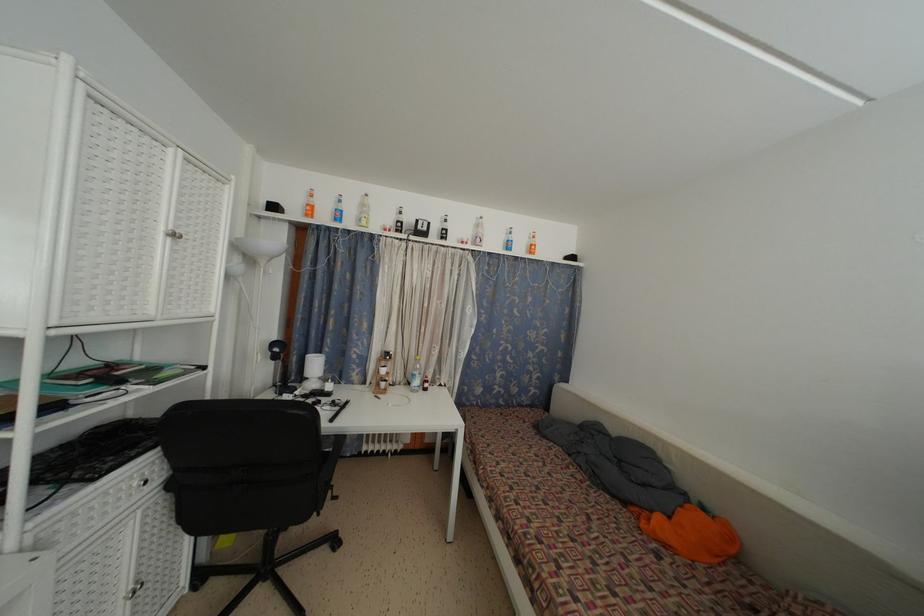
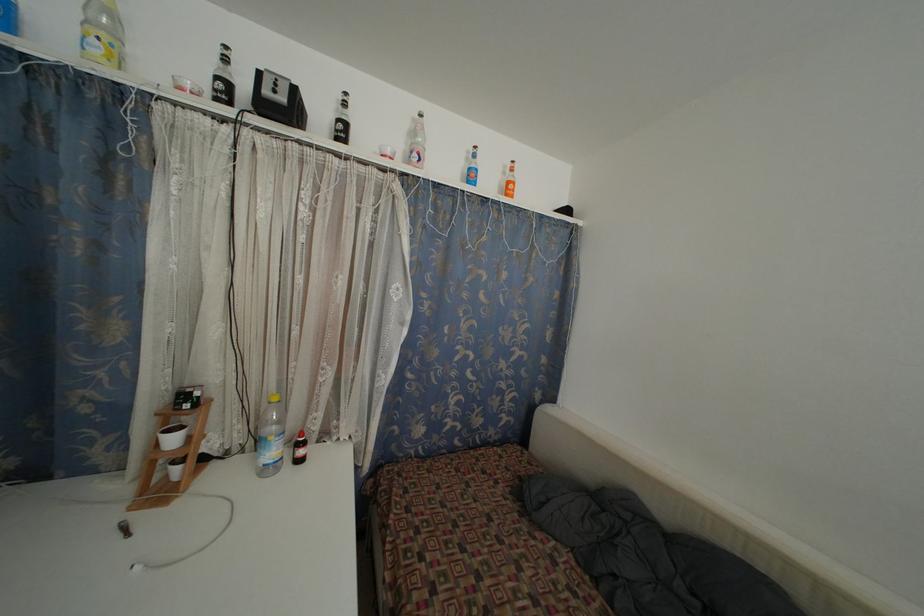
Where in the second image is the point corresponding to the point at 484,241 from the first image?

(423, 154)